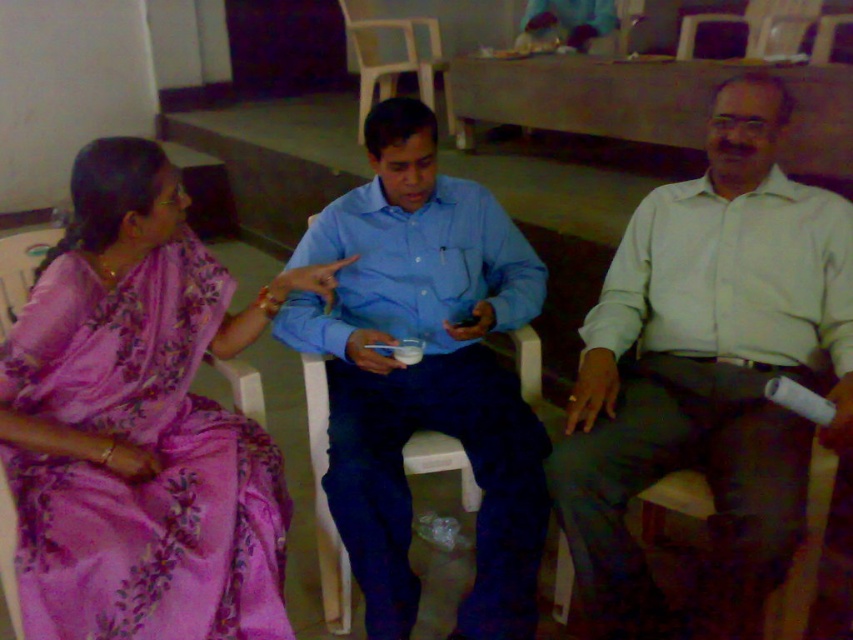
You are standing in front of the three people in the image. You need to hand a document to both the light beige shirt at right and the blue cotton shirt at center. Which one should you approach first to ensure you can reach them without walking past the other?

The light beige shirt at right is closer to the viewer than the blue cotton shirt at center, so you should approach the light beige shirt at right first to avoid walking past them.